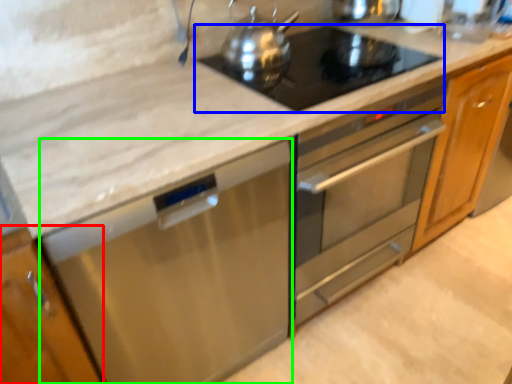
Question: Estimate the real-world distances between objects in this image. Which object is closer to cabinetry (highlighted by a red box), gas stove (highlighted by a blue box) or dish washer (highlighted by a green box)?

Choices:
 (A) gas stove
 (B) dish washer

Answer: (B)